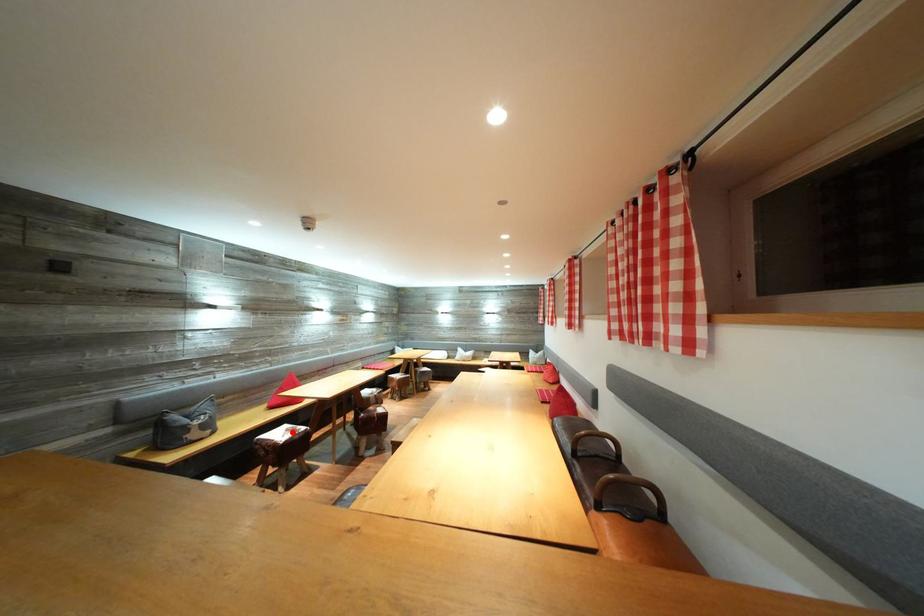
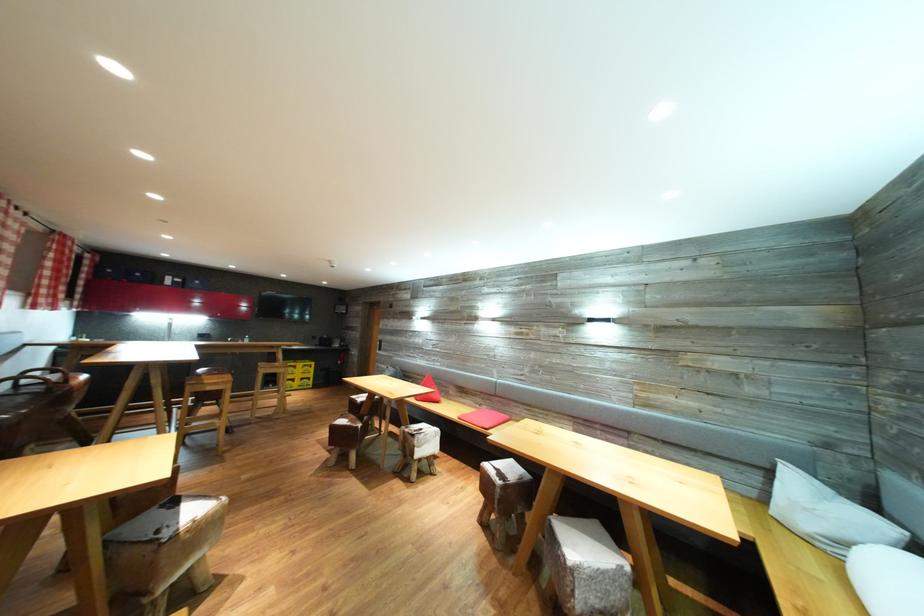
Question: I am providing you with two images of the same scene from different viewpoints. A red point is marked on the first image. At the location where the point appears in image 1, is it still visible in image 2?

Choices:
 (A) Yes
 (B) No

Answer: (B)